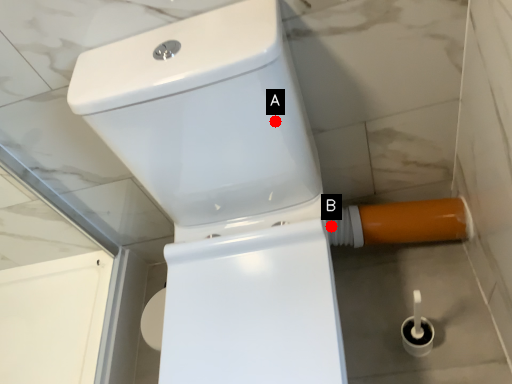
Question: Two points are circled on the image, labeled by A and B beside each circle. Which point is farther to the camera?

Choices:
 (A) A is further
 (B) B is further

Answer: (B)